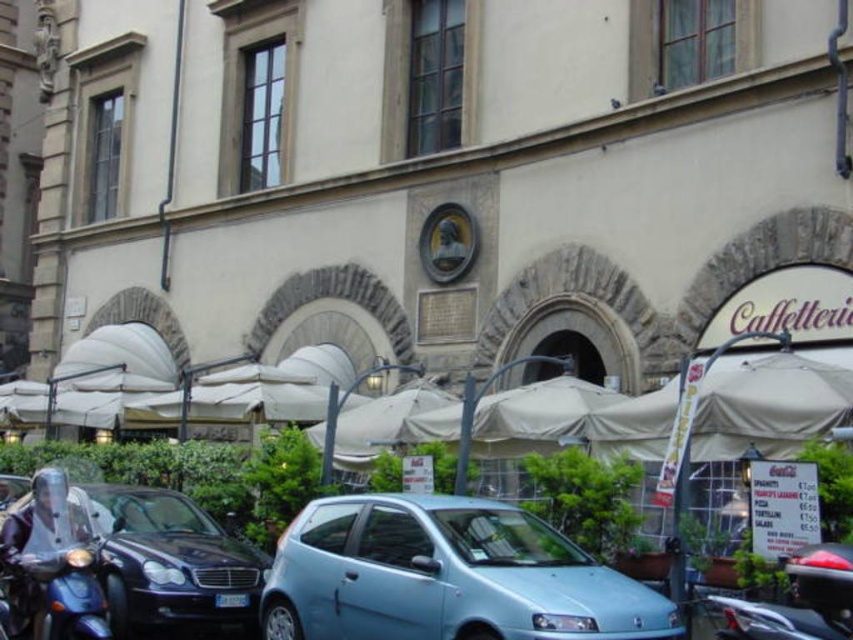
Who is more distant from viewer, (386, 524) or (33, 515)?

Positioned behind is point (386, 524).

Between point (494, 616) and point (47, 481), which one is positioned behind?

Positioned behind is point (47, 481).

You are a GUI agent. You are given a task and a screenshot of the screen. Output one action in this format:
    pyautogui.click(x=<x>, y=<y>)
    Task: Click on the light blue metallic hatchback at center
    
    Given the screenshot: What is the action you would take?
    pyautogui.click(x=445, y=577)

Is point (566, 636) closer to viewer compared to point (165, 492)?

That is True.

Is light blue metallic hatchback at center positioned in front of shiny black car at left?

Yes.

Is point (485, 552) positioned before point (102, 504)?

Yes, it is in front of point (102, 504).

Image resolution: width=853 pixels, height=640 pixels. In order to click on light blue metallic hatchback at center in this screenshot , I will do `click(445, 577)`.

Between shiny black car at left and metallic blue scooter at lower left, which one appears on the right side from the viewer's perspective?

shiny black car at left

Can you confirm if shiny black car at left is positioned to the left of metallic blue scooter at lower left?

No, shiny black car at left is not to the left of metallic blue scooter at lower left.

Is point (105, 595) positioned behind point (16, 621)?

Yes, it is.

Identify the location of shiny black car at left. (171, 563).